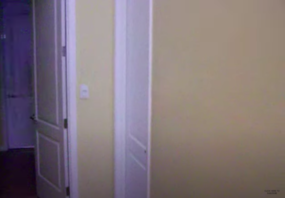
Find the location of `light switch`. light switch is located at coordinates (86, 91).